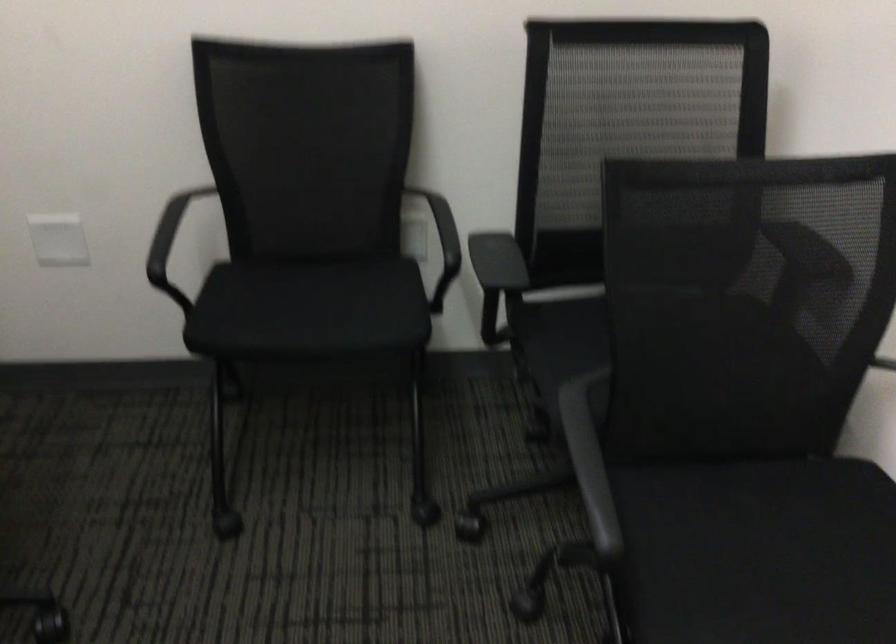
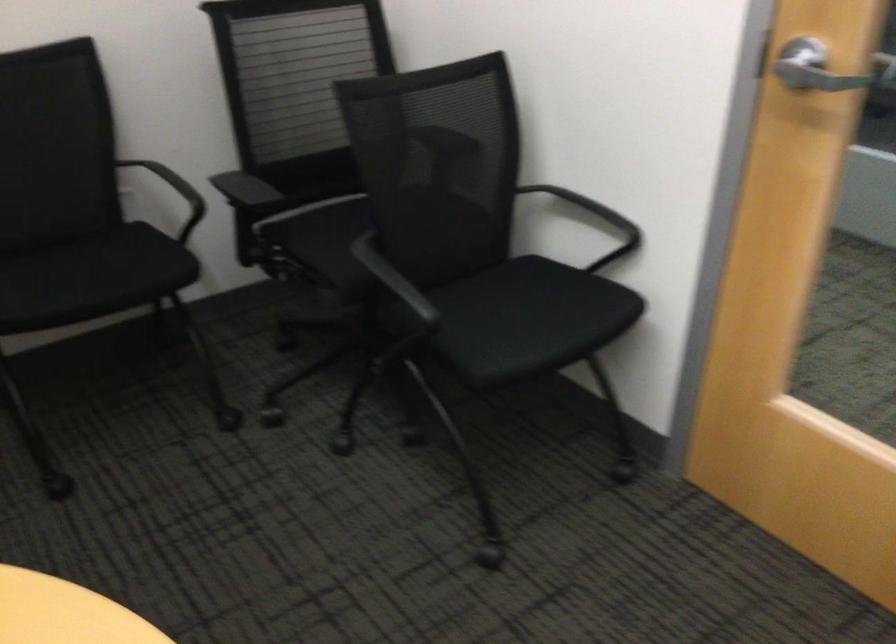
Locate, in the second image, the point that corresponds to (x=555, y=366) in the first image.

(321, 254)